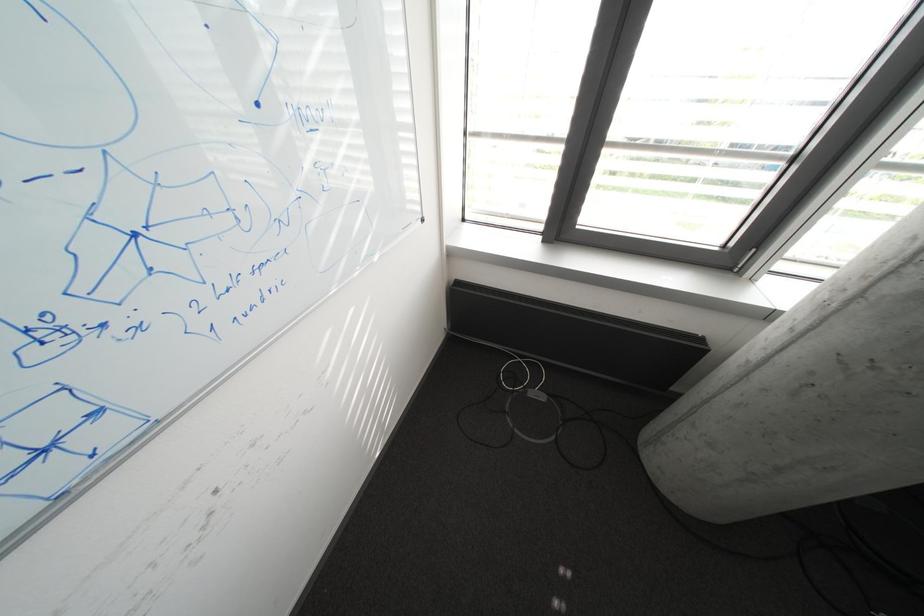
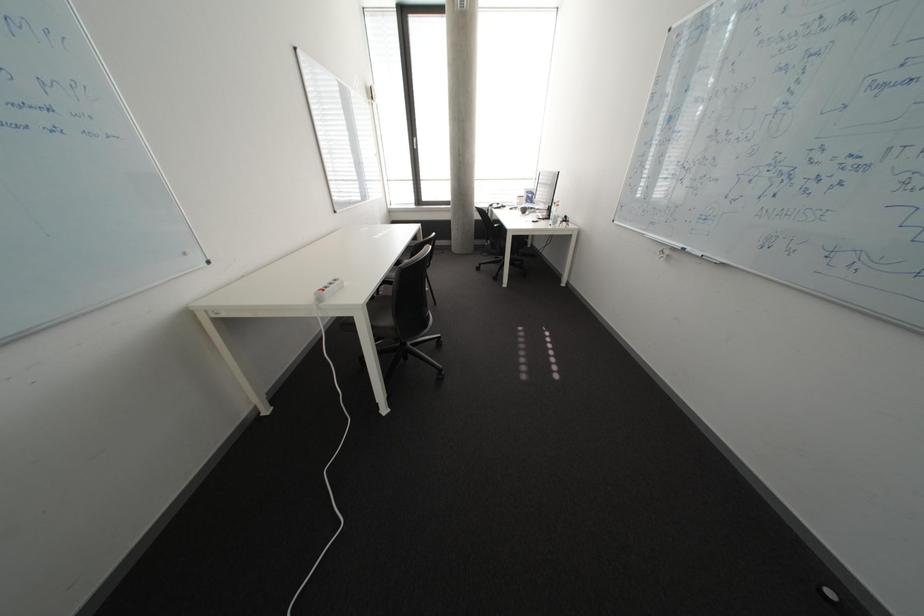
Question: What movement of the cameraman would produce the second image?

Choices:
 (A) Left
 (B) Right
 (C) Forward
 (D) Backward

Answer: (D)